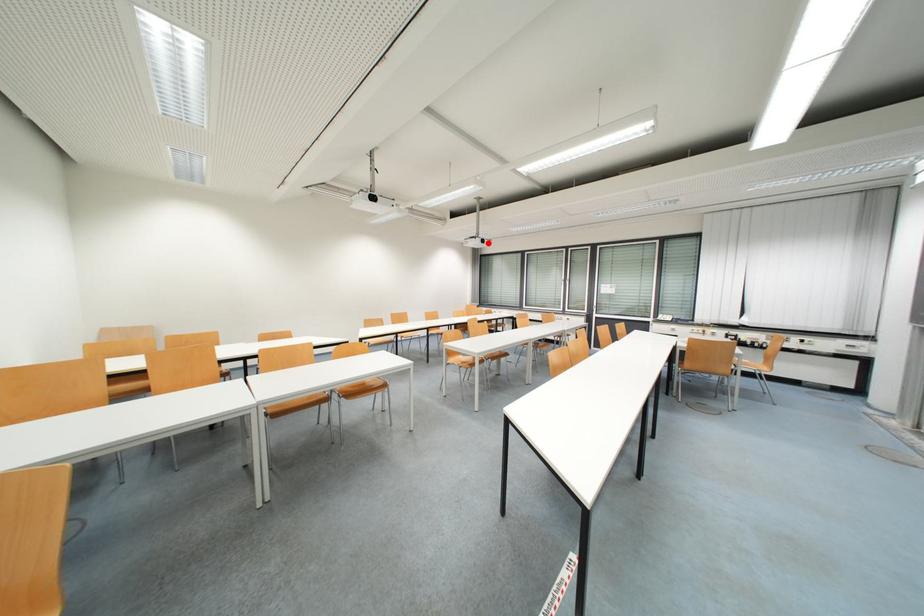
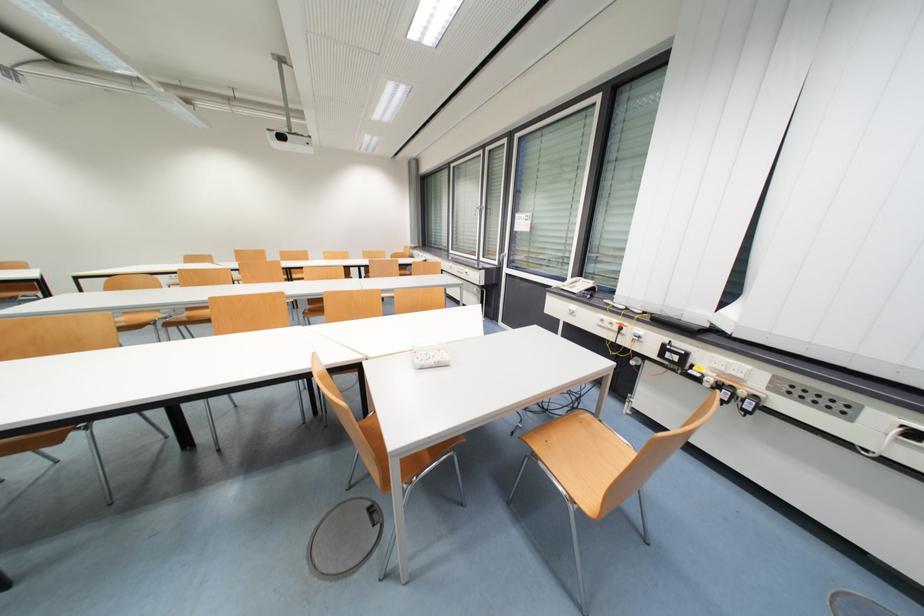
In the second image, find the point that corresponds to the highlighted location in the first image.

(286, 139)